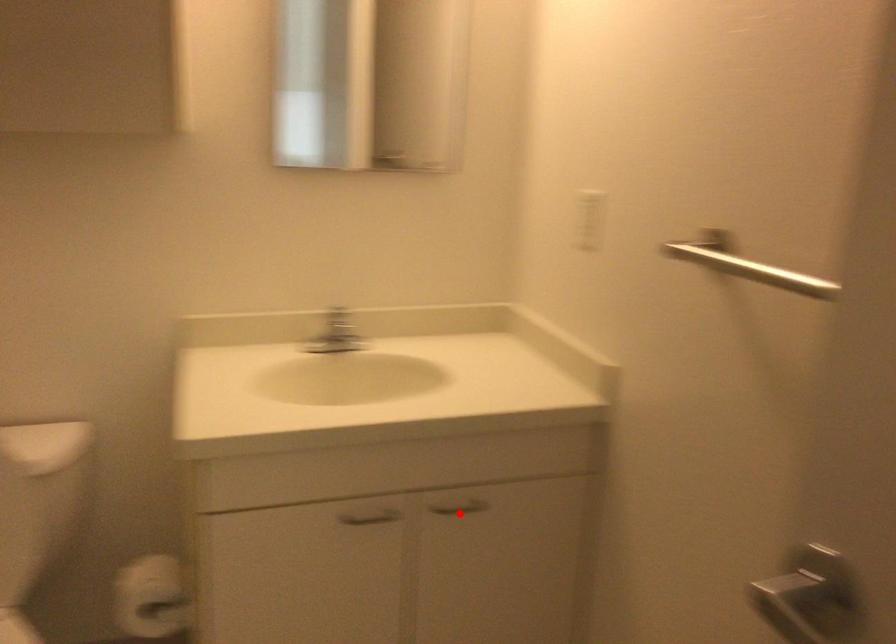
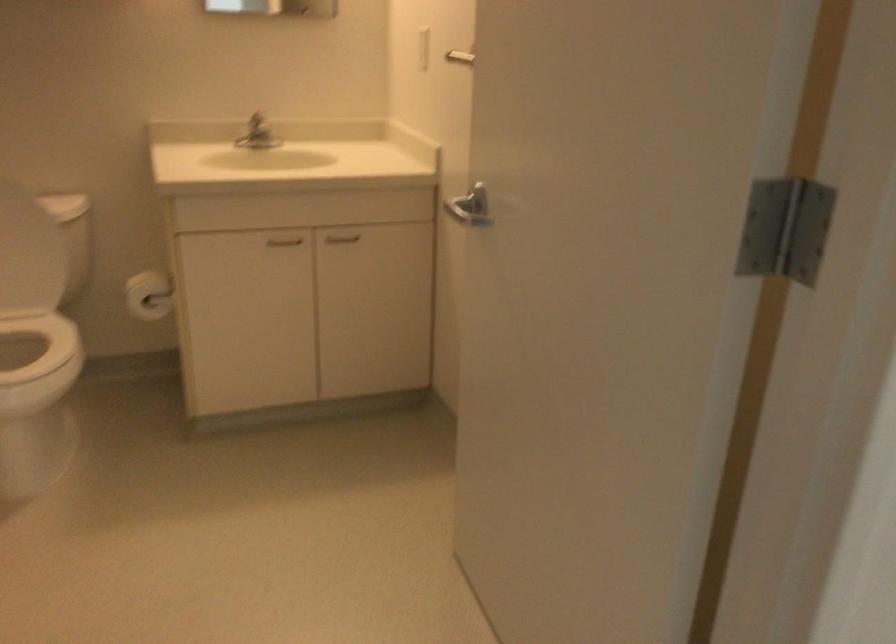
Locate, in the second image, the point that corresponds to the highlighted location in the first image.

(341, 238)